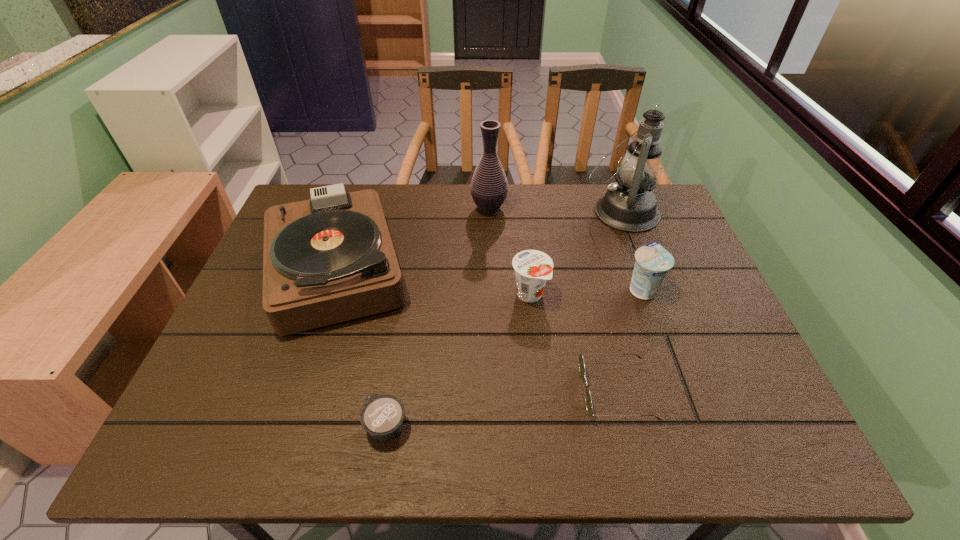
This screenshot has width=960, height=540. What are the coordinates of `free space located on the front of the record player` in the screenshot? It's located at (276, 448).

This screenshot has width=960, height=540. What are the coordinates of `free region located on the back of the rightmost yogurt` in the screenshot? It's located at (625, 241).

Where is `vacant space located on the left of the second yogurt from right to left`? vacant space located on the left of the second yogurt from right to left is located at coordinates (377, 294).

At what (x,y) coordinates should I click in order to perform the action: click on free space located 0.170m on the front-facing side of the sunglasses. Please return your answer as a coordinate pair (x, y). This screenshot has width=960, height=540. Looking at the image, I should click on (502, 391).

Where is `blank area located 0.280m on the front-facing side of the sunglasses`? Image resolution: width=960 pixels, height=540 pixels. blank area located 0.280m on the front-facing side of the sunglasses is located at coordinates (450, 391).

You are a GUI agent. You are given a task and a screenshot of the screen. Output one action in this format:
    pyautogui.click(x=<x>, y=<y>)
    Task: Click on the free space located on the front-facing side of the sunglasses
    
    Given the screenshot: What is the action you would take?
    pyautogui.click(x=455, y=391)

Find the location of `vacant space located 0.310m on the back of the nearest yogurt`. vacant space located 0.310m on the back of the nearest yogurt is located at coordinates (407, 295).

The height and width of the screenshot is (540, 960). In order to click on oil lamp at the far edge in this screenshot , I will do `click(629, 205)`.

The width and height of the screenshot is (960, 540). What are the coordinates of `vase that is at the far edge` in the screenshot? It's located at (489, 187).

You are a GUI agent. You are given a task and a screenshot of the screen. Output one action in this format:
    pyautogui.click(x=<x>, y=<y>)
    Task: Click on the record player located in the far edge section of the desktop
    This screenshot has width=960, height=540.
    Given the screenshot: What is the action you would take?
    pyautogui.click(x=329, y=259)